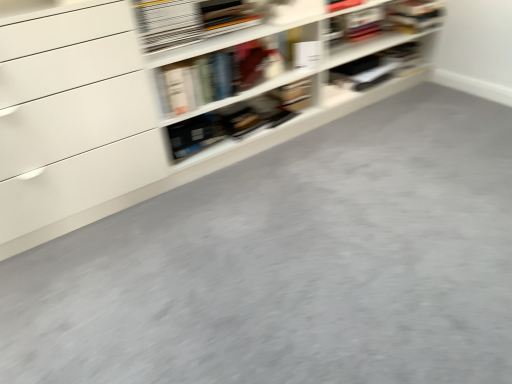
This screenshot has width=512, height=384. Describe the element at coordinates (157, 124) in the screenshot. I see `white matte shelf at upper center` at that location.

I want to click on hardcover book at upper center, which ranks as the 1th book in left-to-right order, so click(191, 20).

Considering the relative sizes of matte black book at upper center, placed as the 2th book when sorted from left to right, and hardcover book at upper center, the 2th book viewed from the right, in the image provided, is matte black book at upper center, placed as the 2th book when sorted from left to right, wider than hardcover book at upper center, the 2th book viewed from the right,?

Correct, the width of matte black book at upper center, placed as the 2th book when sorted from left to right, exceeds that of hardcover book at upper center, the 2th book viewed from the right.

How different are the orientations of matte black book at upper center, which is the 1th book from right to left, and hardcover book at upper center, the 2th book viewed from the right, in degrees?

matte black book at upper center, which is the 1th book from right to left, and hardcover book at upper center, the 2th book viewed from the right, are facing 1.2 degrees away from each other.

From the image's perspective, between matte black book at upper center, marked as the second book in a front-to-back arrangement, and hardcover book at upper center, which is the first book from front to back, who is located below?

matte black book at upper center, marked as the second book in a front-to-back arrangement, from the image's perspective.

Does matte black book at upper center, which is the 1th book from right to left, appear on the left side of hardcover book at upper center, the second book positioned from the back?

No.

From the picture: Considering the positions of objects white matte shelf at upper center and matte black book at upper center, which is the 1th book from right to left, in the image provided, who is more to the left, white matte shelf at upper center or matte black book at upper center, which is the 1th book from right to left,?

Positioned to the left is white matte shelf at upper center.

Can you confirm if white matte shelf at upper center is shorter than matte black book at upper center, marked as the second book in a front-to-back arrangement?

In fact, white matte shelf at upper center may be taller than matte black book at upper center, marked as the second book in a front-to-back arrangement.

Does point (49, 219) lie behind point (379, 67)?

No, it is in front of (379, 67).

Is white matte shelf at upper center positioned far away from matte black book at upper center, placed as the 2th book when sorted from left to right?

They are positioned close to each other.

From a real-world perspective, which object stands above the other?

hardcover book at upper center, the 2th book viewed from the right.

Considering the relative sizes of hardcover book at upper center, the second book positioned from the back, and white matte shelf at upper center in the image provided, is hardcover book at upper center, the second book positioned from the back, bigger than white matte shelf at upper center?

Incorrect, hardcover book at upper center, the second book positioned from the back, is not larger than white matte shelf at upper center.

Between hardcover book at upper center, the second book positioned from the back, and white matte shelf at upper center, which one has smaller width?

With smaller width is hardcover book at upper center, the second book positioned from the back.

Which is correct: hardcover book at upper center, which is the first book from front to back, is inside white matte shelf at upper center, or outside of it?

hardcover book at upper center, which is the first book from front to back, exists entirely within white matte shelf at upper center.

Is matte black book at upper center, which is the 1th book from right to left, at the right side of white matte shelf at upper center?

Yes.

Is matte black book at upper center, marked as the second book in a front-to-back arrangement, aimed at white matte shelf at upper center?

Yes.

How far apart are matte black book at upper center, marked as the 1th book in a back-to-front arrangement, and white matte shelf at upper center?

22.97 inches.

Is hardcover book at upper center, the second book positioned from the back, located within white matte shelf at upper center?

Indeed, hardcover book at upper center, the second book positioned from the back, is located within white matte shelf at upper center.

Is white matte shelf at upper center to the left or to the right of hardcover book at upper center, the second book positioned from the back, in the image?

Clearly, white matte shelf at upper center is on the right of hardcover book at upper center, the second book positioned from the back, in the image.

Where is `shelf on the right of hardcover book at upper center, which ranks as the 1th book in left-to-right order`? This screenshot has width=512, height=384. shelf on the right of hardcover book at upper center, which ranks as the 1th book in left-to-right order is located at coordinates (157, 124).

Can you confirm if white matte shelf at upper center is bigger than hardcover book at upper center, which ranks as the 1th book in left-to-right order?

Yes.

Is hardcover book at upper center, which is the first book from front to back, further to camera compared to matte black book at upper center, which is the 1th book from right to left?

No, the depth of hardcover book at upper center, which is the first book from front to back, is less than that of matte black book at upper center, which is the 1th book from right to left.

Is hardcover book at upper center, which ranks as the 1th book in left-to-right order, wider than matte black book at upper center, marked as the second book in a front-to-back arrangement?

No.

Is matte black book at upper center, which is the 1th book from right to left, located within hardcover book at upper center, which ranks as the 1th book in left-to-right order?

No, matte black book at upper center, which is the 1th book from right to left, is located outside of hardcover book at upper center, which ranks as the 1th book in left-to-right order.

Is point (148, 36) more distant than point (359, 66)?

No, (148, 36) is closer to viewer.

What are the coordinates of `book in front of the matte black book at upper center, marked as the second book in a front-to-back arrangement` in the screenshot? It's located at (191, 20).

Locate an element on the screen. The image size is (512, 384). book below the white matte shelf at upper center (from a real-world perspective) is located at coordinates point(377,67).

Considering their positions, is hardcover book at upper center, the 2th book viewed from the right, positioned further to matte black book at upper center, marked as the 1th book in a back-to-front arrangement, than white matte shelf at upper center?

hardcover book at upper center, the 2th book viewed from the right, is further to matte black book at upper center, marked as the 1th book in a back-to-front arrangement.

Looking at the image, which one is located closer to white matte shelf at upper center, matte black book at upper center, placed as the 2th book when sorted from left to right, or hardcover book at upper center, which is the first book from front to back?

hardcover book at upper center, which is the first book from front to back, is closer to white matte shelf at upper center.

Estimate the real-world distances between objects in this image. Which object is further from hardcover book at upper center, which ranks as the 1th book in left-to-right order, white matte shelf at upper center or matte black book at upper center, placed as the 2th book when sorted from left to right?

Among the two, matte black book at upper center, placed as the 2th book when sorted from left to right, is located further to hardcover book at upper center, which ranks as the 1th book in left-to-right order.

Looking at the image, which one is located closer to hardcover book at upper center, the second book positioned from the back, matte black book at upper center, placed as the 2th book when sorted from left to right, or white matte shelf at upper center?

white matte shelf at upper center lies closer to hardcover book at upper center, the second book positioned from the back, than the other object.

Looking at this image, when comparing their distances from matte black book at upper center, marked as the second book in a front-to-back arrangement, does white matte shelf at upper center or hardcover book at upper center, which is the first book from front to back, seem closer?

white matte shelf at upper center is positioned closer to the anchor matte black book at upper center, marked as the second book in a front-to-back arrangement.

From the image, which object appears to be farther from white matte shelf at upper center, hardcover book at upper center, which ranks as the 1th book in left-to-right order, or matte black book at upper center, placed as the 2th book when sorted from left to right?

matte black book at upper center, placed as the 2th book when sorted from left to right.

Image resolution: width=512 pixels, height=384 pixels. I want to click on book between white matte shelf at upper center and matte black book at upper center, placed as the 2th book when sorted from left to right, in the front-back direction, so click(x=191, y=20).